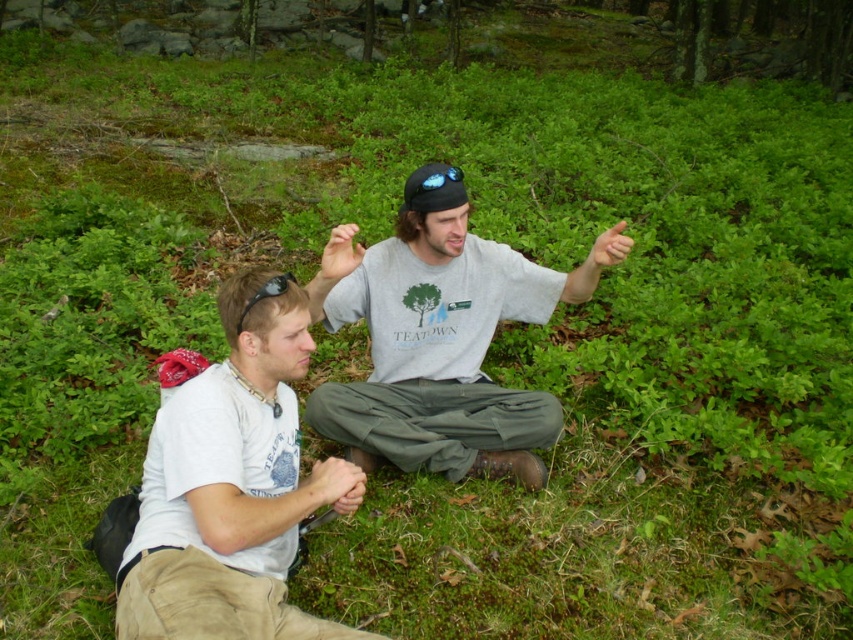
Question: Which object is positioned closest to the gray cotton shirt at center?

Choices:
 (A) matte black thumb at upper right
 (B) black matte baseball cap at center
 (C) matte gray hand at center
 (D) white cotton shirt at lower left

Answer: (C)

Question: Observing the image, what is the correct spatial positioning of khaki pants at lower left in reference to matte black thumb at upper right?

Choices:
 (A) left
 (B) right

Answer: (A)

Question: Can you confirm if white cotton shirt at lower left is thinner than khaki pants at lower left?

Choices:
 (A) yes
 (B) no

Answer: (B)

Question: Which object is positioned farthest from the white cotton shirt at lower left?

Choices:
 (A) matte black thumb at upper right
 (B) smooth skin hand at center

Answer: (A)

Question: Can you confirm if gray cotton shirt at center is positioned to the right of khaki pants at lower left?

Choices:
 (A) yes
 (B) no

Answer: (A)

Question: Which point appears closest to the camera in this image?

Choices:
 (A) (231, 316)
 (B) (490, 320)

Answer: (A)